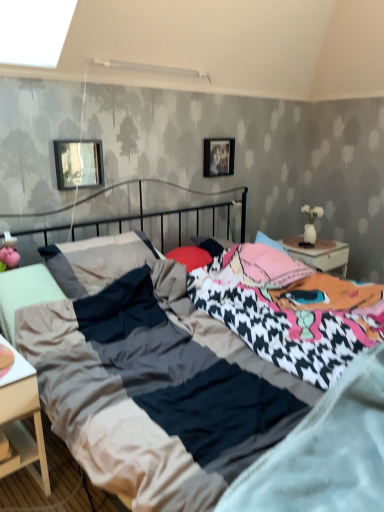
Question: Is white matte nightstand at lower left wider than metallic rectangular frame at upper left, positioned as the 2th picture frame in right-to-left order?

Choices:
 (A) no
 (B) yes

Answer: (B)

Question: Is white matte nightstand at lower left oriented towards metallic rectangular frame at upper left, which appears as the first picture frame when viewed from the front?

Choices:
 (A) yes
 (B) no

Answer: (B)

Question: Is white matte nightstand at lower left far away from metallic rectangular frame at upper left, which appears as the first picture frame when viewed from the front?

Choices:
 (A) no
 (B) yes

Answer: (B)

Question: Can you confirm if white matte nightstand at lower left is taller than metallic rectangular frame at upper left, positioned as the 2th picture frame in right-to-left order?

Choices:
 (A) no
 (B) yes

Answer: (B)

Question: Is the depth of white matte nightstand at lower left less than that of metallic rectangular frame at upper left, positioned as the 2th picture frame in right-to-left order?

Choices:
 (A) no
 (B) yes

Answer: (B)

Question: Is white matte nightstand at lower left touching metallic rectangular frame at upper left, which appears as the first picture frame when viewed from the front?

Choices:
 (A) no
 (B) yes

Answer: (A)

Question: Is soft cotton mattress at center at the right side of metallic rectangular frame at upper left, which appears as the first picture frame when viewed from the front?

Choices:
 (A) yes
 (B) no

Answer: (A)

Question: Does soft cotton mattress at center have a greater width compared to metallic rectangular frame at upper left, which ranks as the second picture frame in back-to-front order?

Choices:
 (A) no
 (B) yes

Answer: (B)

Question: From the image's perspective, is soft cotton mattress at center on top of metallic rectangular frame at upper left, which appears as the first picture frame when viewed from the front?

Choices:
 (A) yes
 (B) no

Answer: (B)

Question: Are soft cotton mattress at center and metallic rectangular frame at upper left, which appears as the first picture frame when viewed from the front, beside each other?

Choices:
 (A) yes
 (B) no

Answer: (B)

Question: From the image's perspective, is soft cotton mattress at center below metallic rectangular frame at upper left, which ranks as the second picture frame in back-to-front order?

Choices:
 (A) yes
 (B) no

Answer: (A)

Question: Can you confirm if soft cotton mattress at center is positioned to the left of metallic rectangular frame at upper left, which ranks as the second picture frame in back-to-front order?

Choices:
 (A) yes
 (B) no

Answer: (B)

Question: Would you say soft cotton mattress at center is part of metallic rectangular frame at upper left, which appears as the 1th picture frame when viewed from the left,'s contents?

Choices:
 (A) yes
 (B) no

Answer: (B)